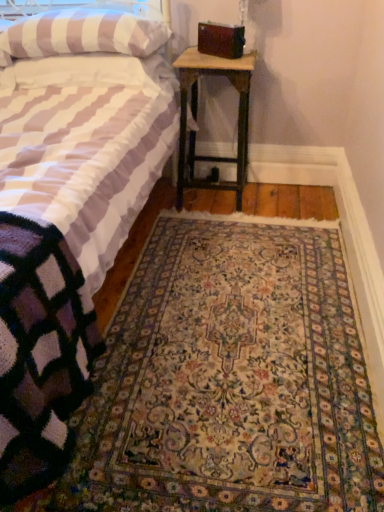
Question: Is carpeted rug at center oriented towards striped fabric pillow at upper left?

Choices:
 (A) yes
 (B) no

Answer: (B)

Question: From the image's perspective, is carpeted rug at center under striped fabric pillow at upper left?

Choices:
 (A) yes
 (B) no

Answer: (A)

Question: From a real-world perspective, is carpeted rug at center on striped fabric pillow at upper left?

Choices:
 (A) yes
 (B) no

Answer: (B)

Question: Are carpeted rug at center and striped fabric pillow at upper left beside each other?

Choices:
 (A) yes
 (B) no

Answer: (B)

Question: Considering the relative sizes of carpeted rug at center and striped fabric pillow at upper left in the image provided, is carpeted rug at center bigger than striped fabric pillow at upper left?

Choices:
 (A) no
 (B) yes

Answer: (B)

Question: Considering their positions, is striped fabric bed at center located in front of or behind striped fabric pillow at upper left?

Choices:
 (A) front
 (B) behind

Answer: (A)

Question: Is striped fabric bed at center wider or thinner than striped fabric pillow at upper left?

Choices:
 (A) thin
 (B) wide

Answer: (B)

Question: Is striped fabric bed at center bigger or smaller than striped fabric pillow at upper left?

Choices:
 (A) small
 (B) big

Answer: (B)

Question: From the image's perspective, is striped fabric bed at center above or below striped fabric pillow at upper left?

Choices:
 (A) below
 (B) above

Answer: (A)

Question: Would you say wooden nightstand at lower right is to the left or to the right of carpeted rug at center in the picture?

Choices:
 (A) left
 (B) right

Answer: (A)

Question: Is wooden nightstand at lower right inside the boundaries of carpeted rug at center, or outside?

Choices:
 (A) outside
 (B) inside

Answer: (A)

Question: Is wooden nightstand at lower right wider or thinner than carpeted rug at center?

Choices:
 (A) wide
 (B) thin

Answer: (B)

Question: From the image's perspective, is wooden nightstand at lower right above or below carpeted rug at center?

Choices:
 (A) below
 (B) above

Answer: (B)

Question: From the image's perspective, relative to striped fabric pillow at upper left, is wooden nightstand at lower right above or below?

Choices:
 (A) above
 (B) below

Answer: (B)

Question: Do you think wooden nightstand at lower right is within striped fabric pillow at upper left, or outside of it?

Choices:
 (A) inside
 (B) outside

Answer: (B)